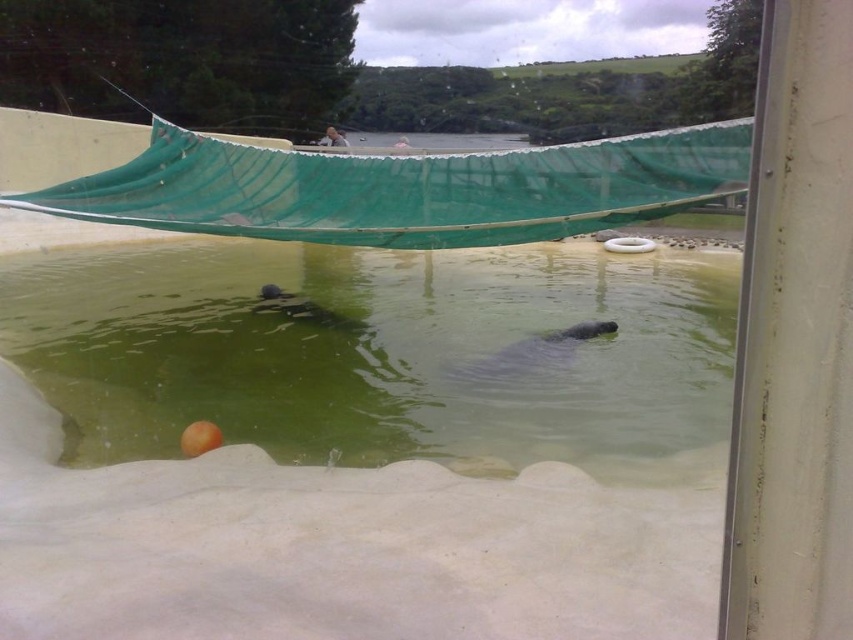
Locate an element on the screen. gray matte otter at center is located at coordinates (532, 352).

Between gray matte otter at center and smooth gray otter at center, which one has less height?

With less height is gray matte otter at center.

Is point (560, 355) positioned in front of point (281, 305)?

Yes, point (560, 355) is in front of point (281, 305).

Locate an element on the screen. This screenshot has height=640, width=853. gray matte otter at center is located at coordinates (532, 352).

Does greenish water at center have a lesser width compared to gray matte otter at center?

In fact, greenish water at center might be wider than gray matte otter at center.

Locate an element on the screen. This screenshot has width=853, height=640. greenish water at center is located at coordinates (381, 353).

This screenshot has width=853, height=640. In order to click on greenish water at center in this screenshot , I will do `click(381, 353)`.

Is greenish water at center smaller than smooth gray otter at center?

Actually, greenish water at center might be larger than smooth gray otter at center.

Between greenish water at center and smooth gray otter at center, which one appears on the left side from the viewer's perspective?

From the viewer's perspective, smooth gray otter at center appears more on the left side.

This screenshot has height=640, width=853. Describe the element at coordinates (381, 353) in the screenshot. I see `greenish water at center` at that location.

Image resolution: width=853 pixels, height=640 pixels. I want to click on greenish water at center, so [381, 353].